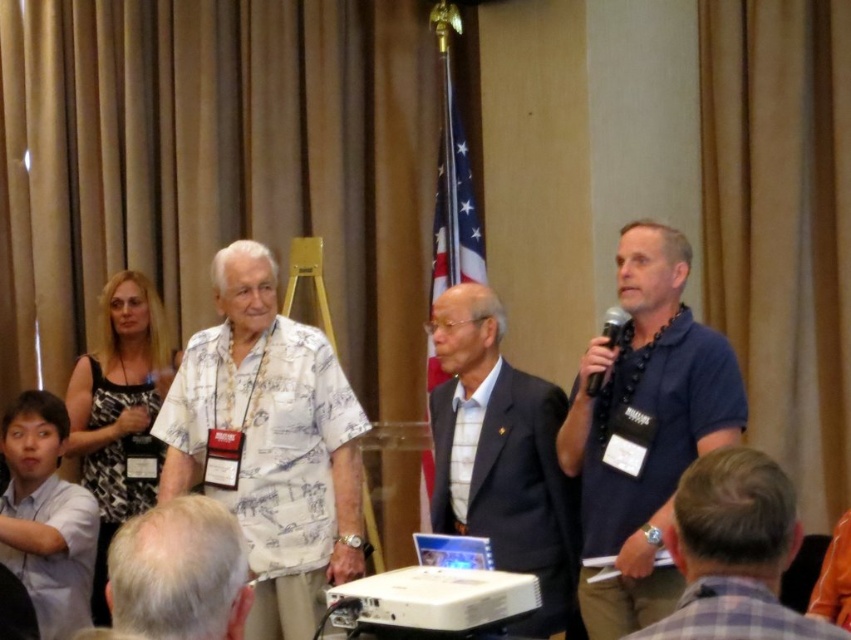
Question: Which point is closer to the camera?

Choices:
 (A) dark blue shirt at right
 (B) white shirt at lower left
 (C) black metallic microphone at right
 (D) gray plaid shirt at lower right

Answer: (D)

Question: Does white printed shirt at center have a lesser width compared to gray plaid shirt at lower right?

Choices:
 (A) yes
 (B) no

Answer: (B)

Question: Which of the following is the farthest from the observer?

Choices:
 (A) dark gray suit at center
 (B) gray plaid shirt at lower right
 (C) gray hair at center
 (D) white printed shirt at center

Answer: (D)

Question: Among these points, which one is nearest to the camera?

Choices:
 (A) (27, 481)
 (B) (561, 540)

Answer: (B)

Question: Can you confirm if dark gray suit at center is smaller than white shirt at lower left?

Choices:
 (A) yes
 (B) no

Answer: (B)

Question: Does white printed shirt at center appear under dark gray suit at center?

Choices:
 (A) no
 (B) yes

Answer: (A)